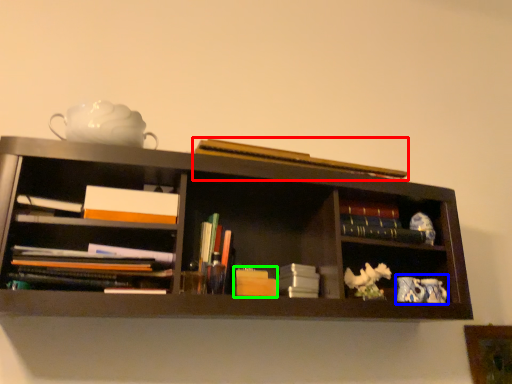
Question: Which is farther away from book (highlighted by a red box)? tea set (highlighted by a blue box) or book (highlighted by a green box)?

Choices:
 (A) tea set
 (B) book

Answer: (A)